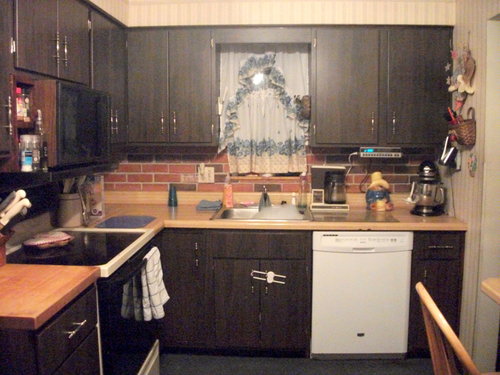
Locate an element on the screen. The width and height of the screenshot is (500, 375). sink is located at coordinates (266, 211).